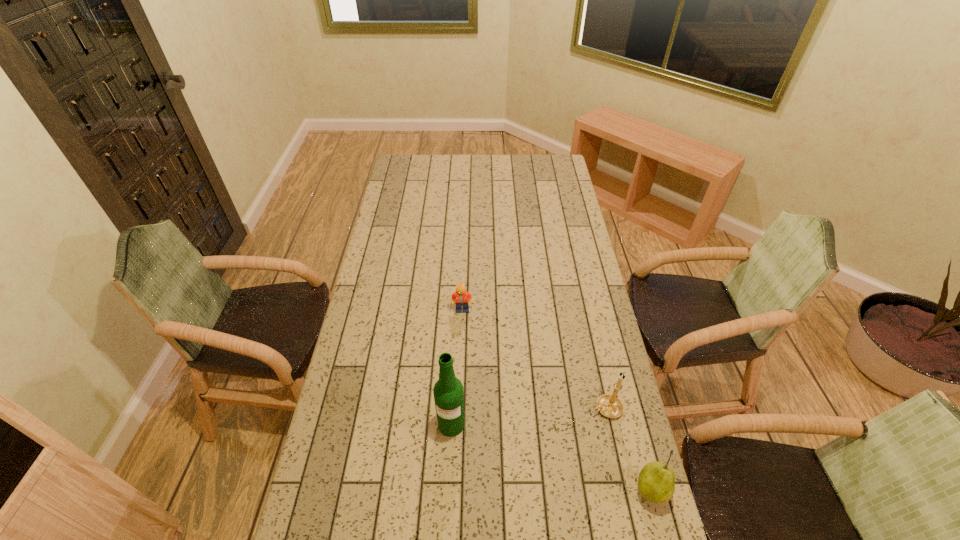
Identify the location of free location located on the front-facing side of the Lego. This screenshot has height=540, width=960. (470, 322).

Image resolution: width=960 pixels, height=540 pixels. Find the location of `free location located on the front-facing side of the Lego`. free location located on the front-facing side of the Lego is located at coordinates (485, 352).

This screenshot has height=540, width=960. I want to click on object at the near edge, so click(656, 484).

Where is `pear that is at the right edge`? The width and height of the screenshot is (960, 540). pear that is at the right edge is located at coordinates (656, 484).

Locate an element on the screen. candle holder located at the right edge is located at coordinates (609, 405).

What are the coordinates of `object located in the near right corner section of the desktop` in the screenshot? It's located at (656, 484).

Identify the location of vacant space at the far edge of the desktop. (456, 160).

You are a GUI agent. You are given a task and a screenshot of the screen. Output one action in this format:
    pyautogui.click(x=<x>, y=<y>)
    Task: Click on the free region at the left edge of the desktop
    
    Given the screenshot: What is the action you would take?
    pyautogui.click(x=386, y=346)

The image size is (960, 540). What are the coordinates of `vacant region at the right edge of the desktop` in the screenshot? It's located at (558, 196).

In the image, there is a desktop. In order to click on vacant area at the far right corner in this screenshot , I will do `click(540, 161)`.